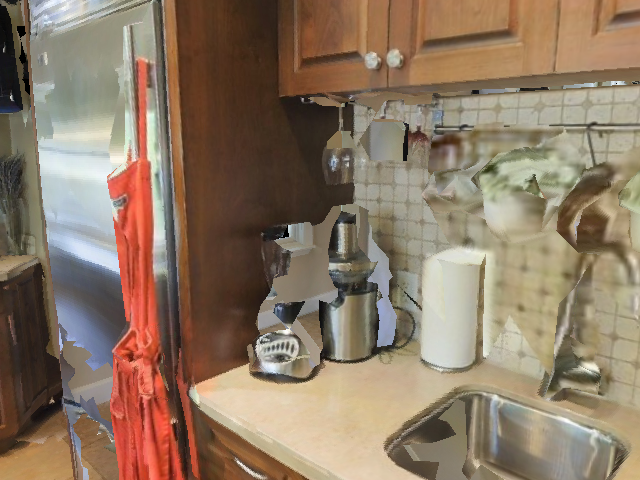
The width and height of the screenshot is (640, 480). Find the location of `paper towels`. paper towels is located at coordinates (472, 336).